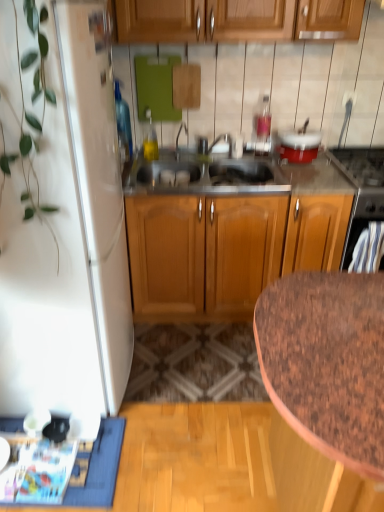
This screenshot has width=384, height=512. I want to click on free space to the right of blue fabric doormat at lower left, so click(x=177, y=441).